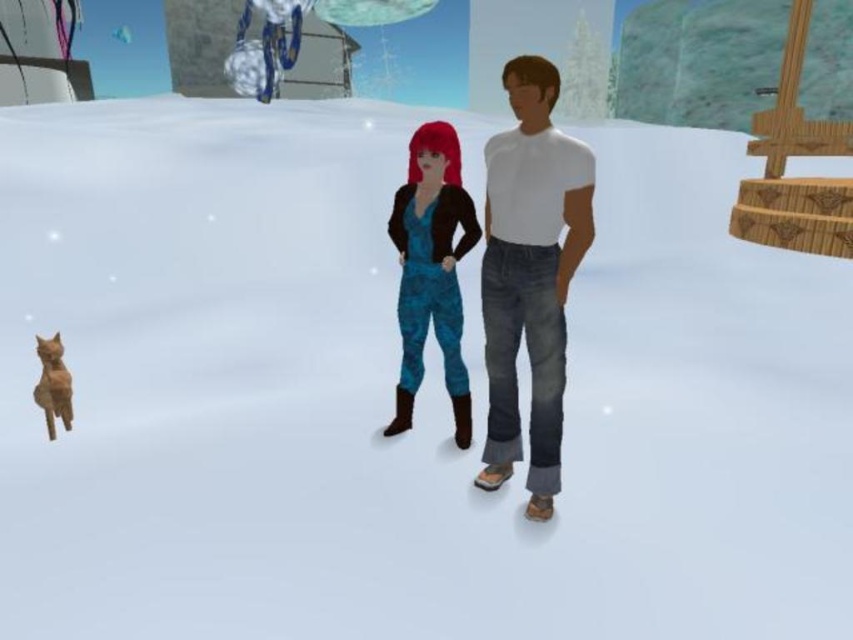
Can you confirm if white matte shirt at center is positioned to the left of orange fur cat at lower left?

Incorrect, white matte shirt at center is not on the left side of orange fur cat at lower left.

Which is below, white matte shirt at center or orange fur cat at lower left?

orange fur cat at lower left is lower down.

The width and height of the screenshot is (853, 640). Find the location of `white matte shirt at center`. white matte shirt at center is located at coordinates (531, 275).

Based on the photo, who is more distant from viewer, [538,109] or [419,296]?

The point [419,296] is behind.

Is white matte shirt at center bigger than blue camouflage jumpsuit at center?

Yes, white matte shirt at center is bigger than blue camouflage jumpsuit at center.

This screenshot has width=853, height=640. What are the coordinates of `white matte shirt at center` in the screenshot? It's located at (531, 275).

You are a GUI agent. You are given a task and a screenshot of the screen. Output one action in this format:
    pyautogui.click(x=<x>, y=<y>)
    Task: Click on the white matte shirt at center
    The width and height of the screenshot is (853, 640).
    Given the screenshot: What is the action you would take?
    [531, 275]

Can you confirm if blue camouflage jumpsuit at center is taller than orange fur cat at lower left?

Correct, blue camouflage jumpsuit at center is much taller as orange fur cat at lower left.

Which is in front, point (454, 276) or point (51, 406)?

Point (454, 276) is more forward.

What do you see at coordinates (431, 269) in the screenshot? I see `blue camouflage jumpsuit at center` at bounding box center [431, 269].

This screenshot has width=853, height=640. Find the location of `blue camouflage jumpsuit at center`. blue camouflage jumpsuit at center is located at coordinates (431, 269).